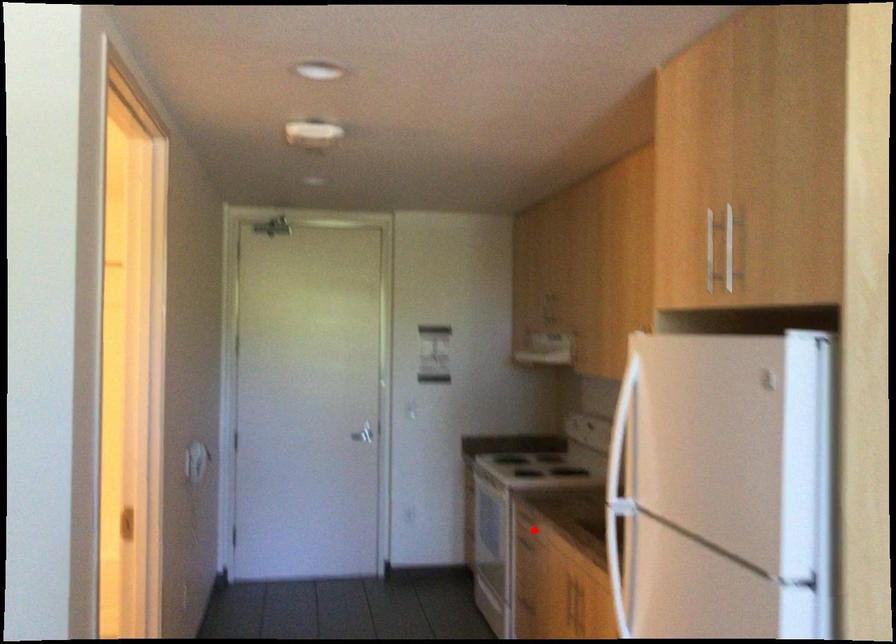
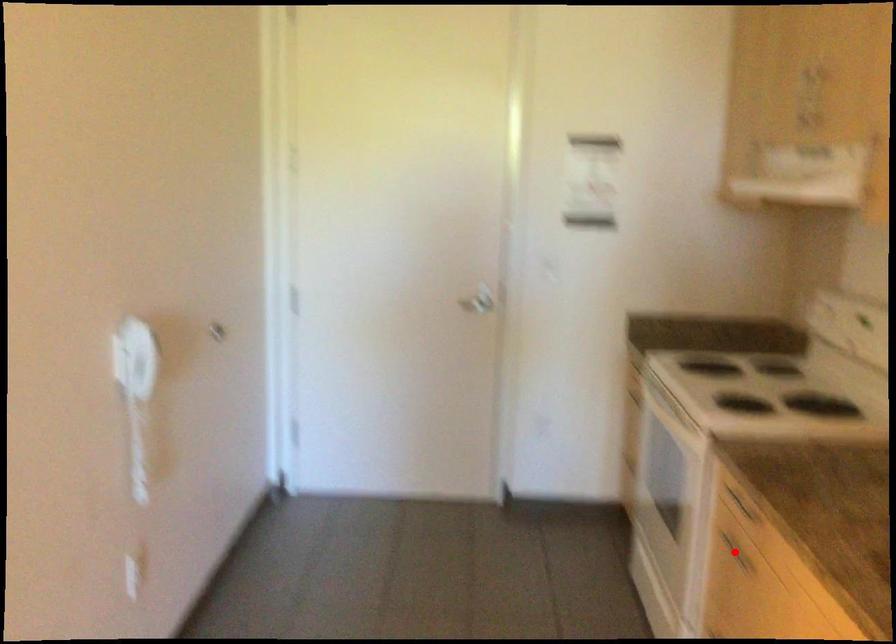
I am providing you with two images of the same scene from different viewpoints. A red point is marked on the first image and another point is marked on the second image. Are the points marked in image1 and image2 representing the same 3D position?

Yes